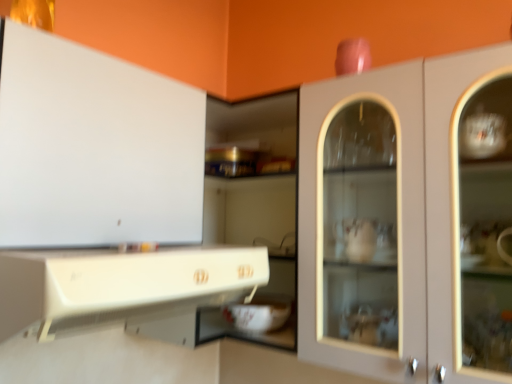
Question: Considering the relative sizes of white glossy cabinet at lower left, arranged as the 2th cabinetry when viewed from the right, and white glossy cabinet at upper left, the 3th cabinetry when ordered from right to left, in the image provided, is white glossy cabinet at lower left, arranged as the 2th cabinetry when viewed from the right, thinner than white glossy cabinet at upper left, the 3th cabinetry when ordered from right to left,?

Choices:
 (A) yes
 (B) no

Answer: (B)

Question: Considering the relative sizes of white glossy cabinet at lower left, arranged as the 2th cabinetry when viewed from the right, and white glossy cabinet at upper left, which appears as the first cabinetry when viewed from the left, in the image provided, is white glossy cabinet at lower left, arranged as the 2th cabinetry when viewed from the right, bigger than white glossy cabinet at upper left, which appears as the first cabinetry when viewed from the left,?

Choices:
 (A) no
 (B) yes

Answer: (A)

Question: Considering the relative sizes of white glossy cabinet at lower left, which is the second cabinetry from left to right, and white glossy cabinet at upper left, which appears as the first cabinetry when viewed from the left, in the image provided, is white glossy cabinet at lower left, which is the second cabinetry from left to right, smaller than white glossy cabinet at upper left, which appears as the first cabinetry when viewed from the left,?

Choices:
 (A) no
 (B) yes

Answer: (B)

Question: Can you confirm if white glossy cabinet at lower left, arranged as the 2th cabinetry when viewed from the right, is wider than white glossy cabinet at upper left, the 3th cabinetry when ordered from right to left?

Choices:
 (A) no
 (B) yes

Answer: (B)

Question: Does white glossy cabinet at lower left, arranged as the 2th cabinetry when viewed from the right, appear on the left side of white glossy cabinet at upper left, the 3th cabinetry when ordered from right to left?

Choices:
 (A) no
 (B) yes

Answer: (A)

Question: Which is correct: matte white cabinet at center, the 1th cabinetry viewed from the right, is inside white glossy cabinet at lower left, which is the second cabinetry from left to right, or outside of it?

Choices:
 (A) inside
 (B) outside

Answer: (B)

Question: From their relative heights in the image, would you say matte white cabinet at center, the 1th cabinetry viewed from the right, is taller or shorter than white glossy cabinet at lower left, arranged as the 2th cabinetry when viewed from the right?

Choices:
 (A) tall
 (B) short

Answer: (A)

Question: Considering the positions of point [457, 281] and point [193, 264], is point [457, 281] closer or farther from the camera than point [193, 264]?

Choices:
 (A) farther
 (B) closer

Answer: (A)

Question: From the image's perspective, is matte white cabinet at center, arranged as the third cabinetry when viewed from the left, positioned above or below white glossy cabinet at lower left, which is the second cabinetry from left to right?

Choices:
 (A) above
 (B) below

Answer: (A)

Question: Is white glossy cabinet at upper left, which appears as the first cabinetry when viewed from the left, situated inside matte white cabinet at center, the 1th cabinetry viewed from the right, or outside?

Choices:
 (A) inside
 (B) outside

Answer: (B)

Question: Does point (6, 175) appear closer or farther from the camera than point (477, 87)?

Choices:
 (A) farther
 (B) closer

Answer: (B)

Question: Is white glossy cabinet at upper left, which appears as the first cabinetry when viewed from the left, bigger or smaller than matte white cabinet at center, the 1th cabinetry viewed from the right?

Choices:
 (A) big
 (B) small

Answer: (B)

Question: In the image, is white glossy cabinet at upper left, which appears as the first cabinetry when viewed from the left, on the left side or the right side of matte white cabinet at center, the 1th cabinetry viewed from the right?

Choices:
 (A) left
 (B) right

Answer: (A)

Question: From a real-world perspective, is matte white cabinet at center, arranged as the third cabinetry when viewed from the left, positioned above or below white glossy cabinet at upper left, the 3th cabinetry when ordered from right to left?

Choices:
 (A) above
 (B) below

Answer: (A)

Question: Does point (340, 246) appear closer or farther from the camera than point (110, 193)?

Choices:
 (A) farther
 (B) closer

Answer: (A)